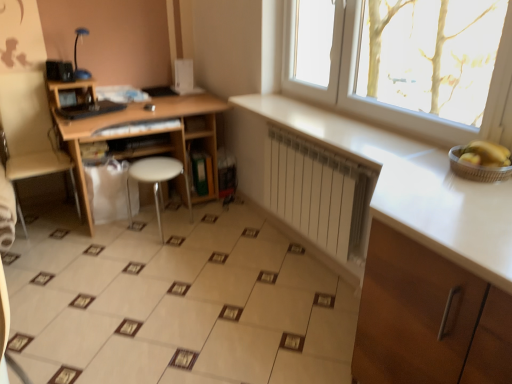
Find the location of a particular element. The image size is (512, 384). vacant space in between beige fabric swivel chair at left and wooden desk at left is located at coordinates (61, 240).